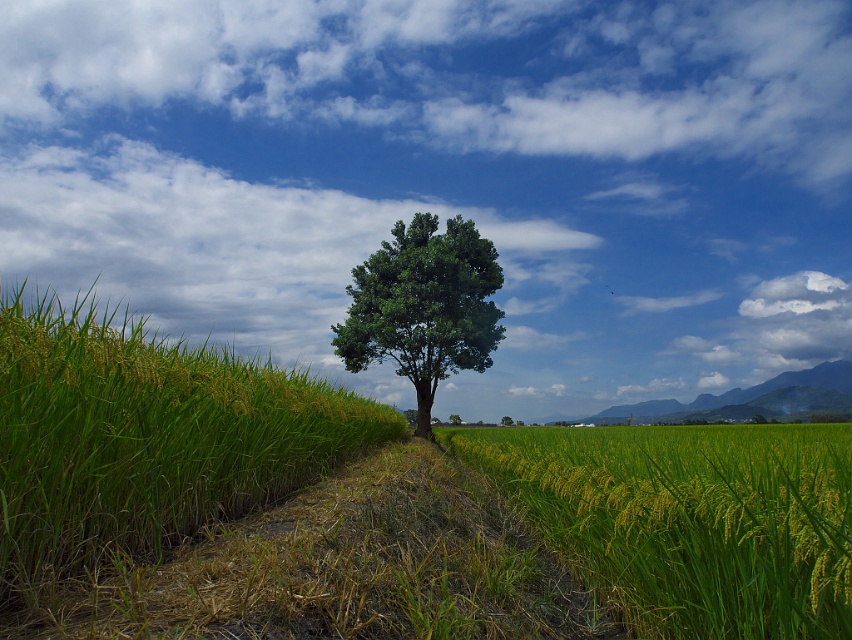
Question: Based on their relative distances, which object is nearer to the green matte tree at center?

Choices:
 (A) green grassy hillside at lower right
 (B) green leafy tree at center

Answer: (B)

Question: Among these objects, which one is farthest from the camera?

Choices:
 (A) green leafy tree at center
 (B) green matte wheat field at center

Answer: (A)

Question: Can you confirm if green matte wheat field at center is positioned to the left of green matte tree at center?

Choices:
 (A) no
 (B) yes

Answer: (B)

Question: Does green matte wheat field at center appear on the right side of green matte tree at center?

Choices:
 (A) yes
 (B) no

Answer: (B)

Question: Which object is closer to the camera taking this photo?

Choices:
 (A) green grassy hillside at lower right
 (B) green leafy tree at center
 (C) green matte wheat field at center

Answer: (C)

Question: In this image, where is green matte wheat field at center located relative to green grassy hillside at lower right?

Choices:
 (A) left
 (B) right

Answer: (A)